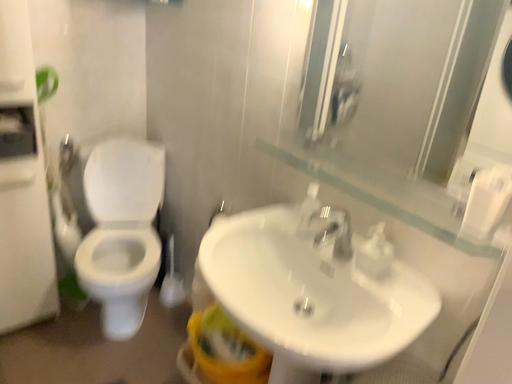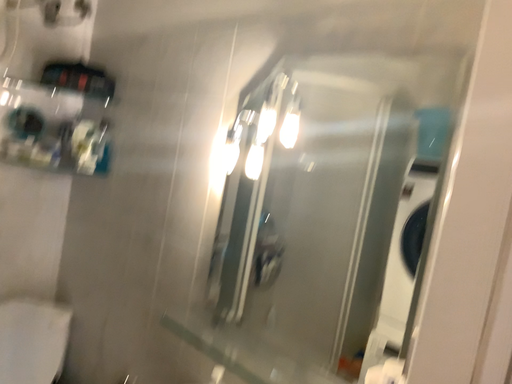
Question: How did the camera likely rotate when shooting the video?

Choices:
 (A) rotated left
 (B) rotated right

Answer: (B)